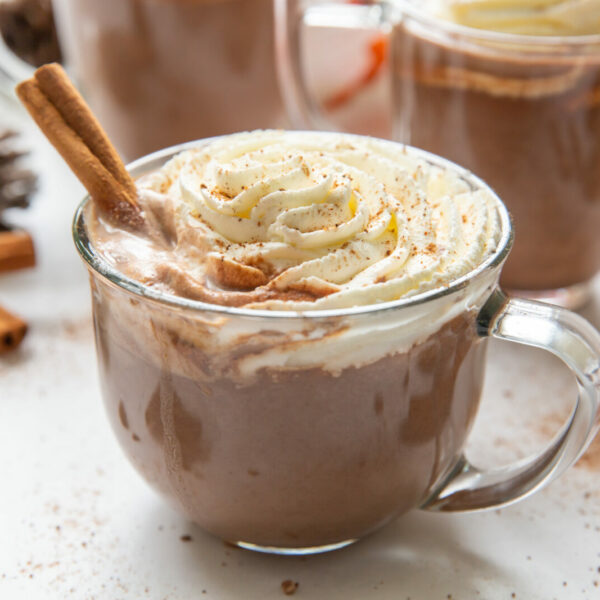
Locate an element on the screen. mug is located at coordinates (360, 411).